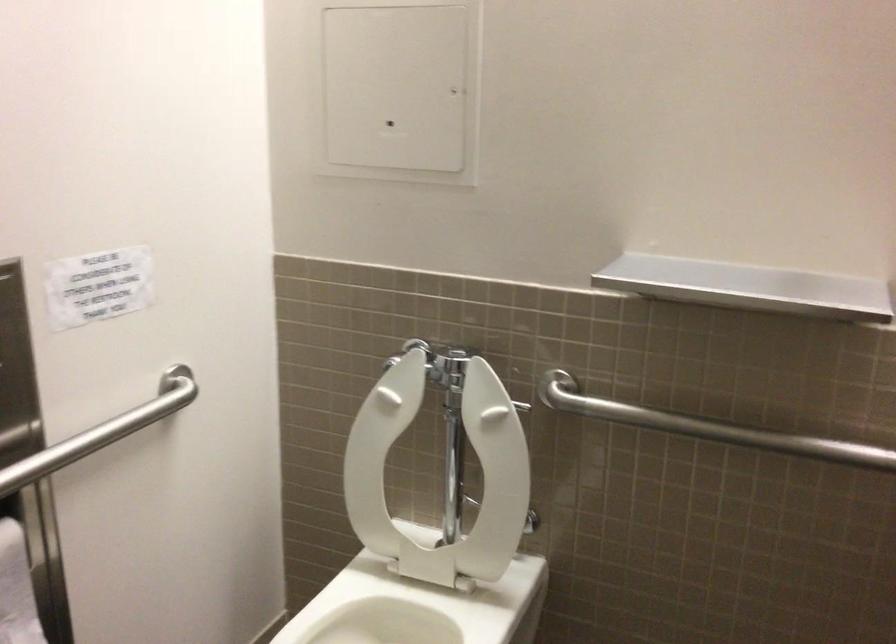
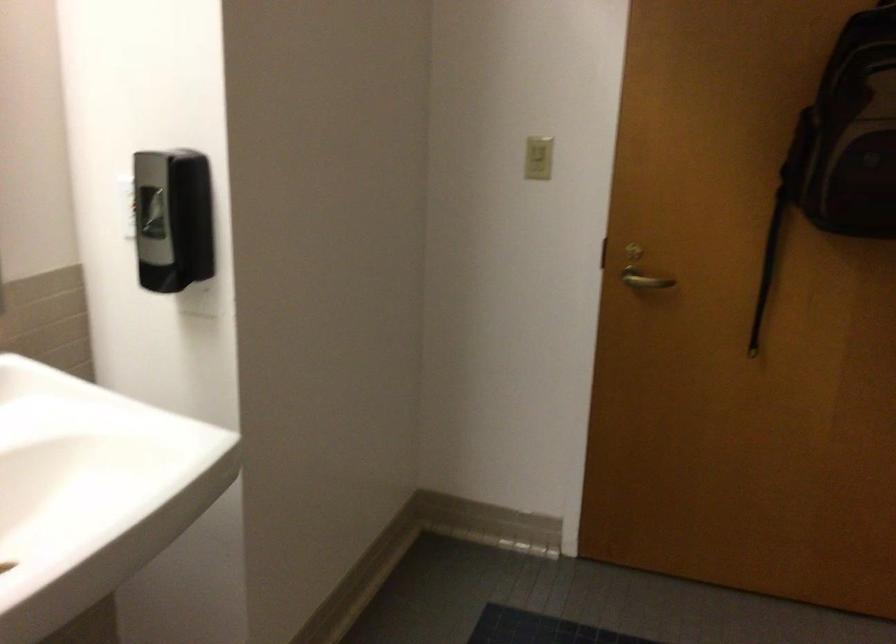
Based on the continuous images, in which direction is the camera rotating?

The camera's rotation is toward right-down.